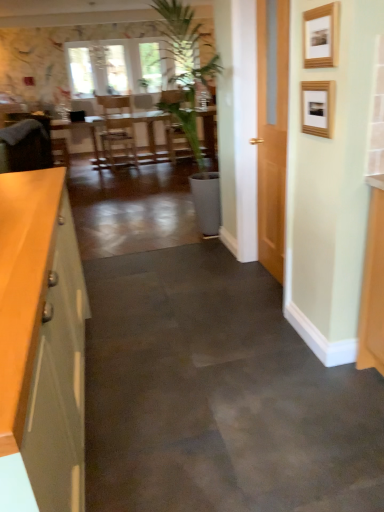
Question: In terms of size, does velvet brown armchair at left appear bigger or smaller than wooden picture frame at upper right, acting as the first picture frame starting from the top?

Choices:
 (A) big
 (B) small

Answer: (A)

Question: In terms of width, does velvet brown armchair at left look wider or thinner when compared to wooden picture frame at upper right, acting as the first picture frame starting from the top?

Choices:
 (A) thin
 (B) wide

Answer: (B)

Question: Estimate the real-world distances between objects in this image. Which object is closer to the velvet brown armchair at left?

Choices:
 (A) wooden picture frame at upper right, acting as the first picture frame starting from the bottom
 (B) wooden picture frame at upper right, placed as the second picture frame when sorted from bottom to top
 (C) matte gray cabinet at left
 (D) wooden table at center

Answer: (C)

Question: Considering the real-world distances, which object is farthest from the wooden picture frame at upper right, acting as the first picture frame starting from the bottom?

Choices:
 (A) matte gray cabinet at left
 (B) wooden table at center
 (C) wooden picture frame at upper right, acting as the first picture frame starting from the top
 (D) velvet brown armchair at left

Answer: (B)